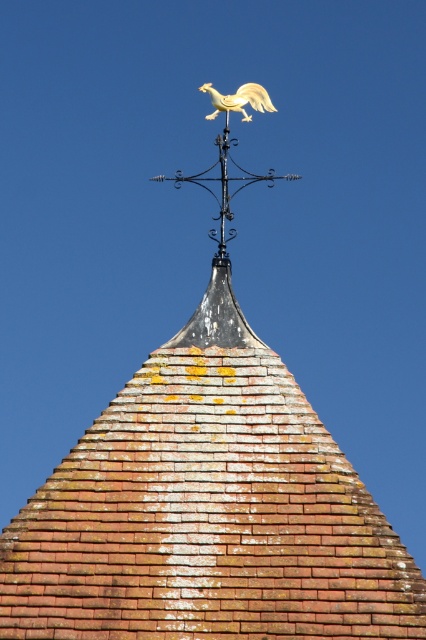
You are an architect examining a historic building. You notice two roosters on the roof. Which one is closer to you, the gold matte rooster at upper center or the gold polished rooster at upper center?

The gold matte rooster at upper center is closer to you because it is in front of the gold polished rooster at upper center.

Looking at this image, you are an architect examining a historic building. You notice two roosters on the roof weather vane. The first is labeled as the gold matte rooster at upper center, and the second is the gold polished rooster at upper center. Which rooster is taller?

The gold matte rooster at upper center is taller than the gold polished rooster at upper center.